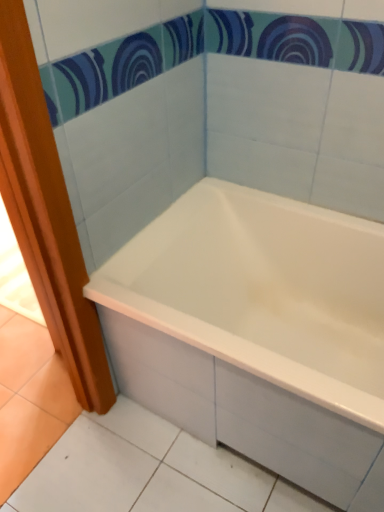
What is the approximate width of white glossy bathtub at center?

It is 28.09 inches.

Find the location of a particular element. The image size is (384, 512). white glossy bathtub at center is located at coordinates (257, 333).

In the scene shown: What is the approximate height of white glossy bathtub at center?

The height of white glossy bathtub at center is 57.13 centimeters.

Describe the element at coordinates (257, 333) in the screenshot. The image size is (384, 512). I see `white glossy bathtub at center` at that location.

This screenshot has width=384, height=512. Identify the location of white glossy bathtub at center. (257, 333).